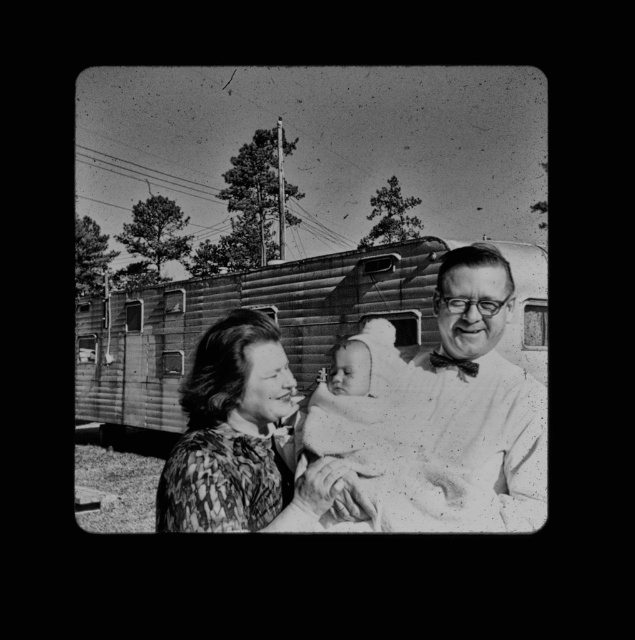
You are a GUI agent. You are given a task and a screenshot of the screen. Output one action in this format:
    pyautogui.click(x=<x>, y=<y>)
    Task: Click on the smooth white shirt at center
    The width and height of the screenshot is (635, 640).
    Given the screenshot: What is the action you would take?
    pyautogui.click(x=444, y=417)

Does point (396, 448) lie in front of point (312, 502)?

No, (396, 448) is behind (312, 502).

This screenshot has height=640, width=635. What are the coordinates of `smooth white shirt at center` in the screenshot? It's located at (444, 417).

Is wooden trailer at center shorter than patterned fabric woman at center?

In fact, wooden trailer at center may be taller than patterned fabric woman at center.

Is wooden trailer at center bigger than patterned fabric woman at center?

Indeed, wooden trailer at center has a larger size compared to patterned fabric woman at center.

Where is `wooden trailer at center`? The height and width of the screenshot is (640, 635). wooden trailer at center is located at coordinates (250, 307).

Identify the location of wooden trailer at center. (250, 307).

Does smooth white shirt at center have a greater height compared to wooden trailer at center?

No, smooth white shirt at center is not taller than wooden trailer at center.

Between smooth white shirt at center and wooden trailer at center, which one is positioned lower?

Positioned lower is smooth white shirt at center.

Describe the element at coordinates (444, 417) in the screenshot. I see `smooth white shirt at center` at that location.

In order to click on smooth white shirt at center in this screenshot , I will do `click(444, 417)`.